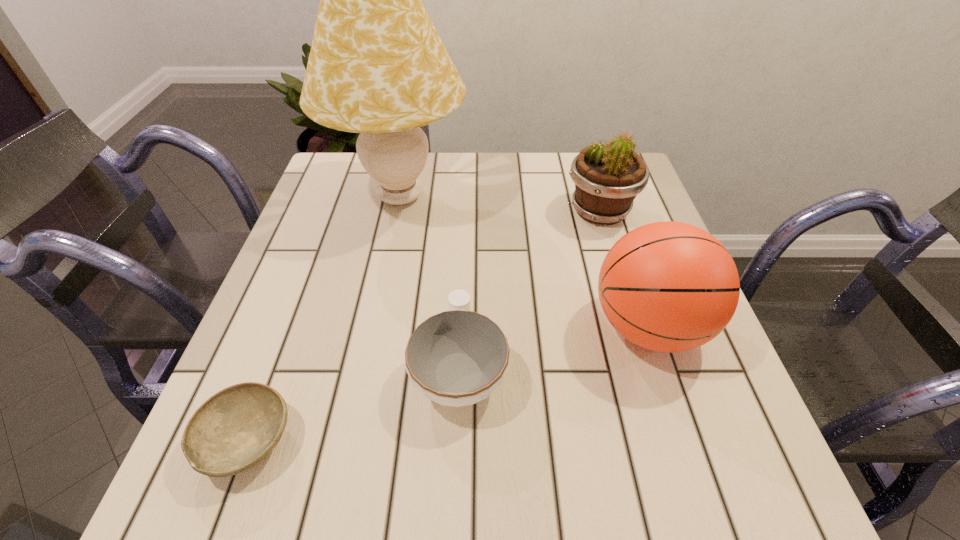
Identify the location of free point located 0.160m on the side with the handle of the second shortest object. (464, 264).

You are a GUI agent. You are given a task and a screenshot of the screen. Output one action in this format:
    pyautogui.click(x=<x>, y=<y>)
    Task: Click on the free spot located on the back of the shortest object
    The height and width of the screenshot is (540, 960).
    Given the screenshot: What is the action you would take?
    pyautogui.click(x=323, y=241)

The height and width of the screenshot is (540, 960). What are the coordinates of `lampshade at the far edge` in the screenshot? It's located at (377, 66).

Locate an element on the screen. The height and width of the screenshot is (540, 960). flowerpot that is at the far edge is located at coordinates (607, 179).

Identify the location of object located in the near edge section of the desktop. The image size is (960, 540). pyautogui.click(x=235, y=429).

In order to click on lampshade at the left edge in this screenshot , I will do `click(377, 66)`.

Identify the location of bowl that is positioned at the left edge. The height and width of the screenshot is (540, 960). (235, 429).

Identify the location of flowerpot located in the right edge section of the desktop. The width and height of the screenshot is (960, 540). (607, 179).

Locate an element on the screen. basketball that is at the right edge is located at coordinates coord(667,286).

Where is `object at the far left corner`? object at the far left corner is located at coordinates (377, 66).